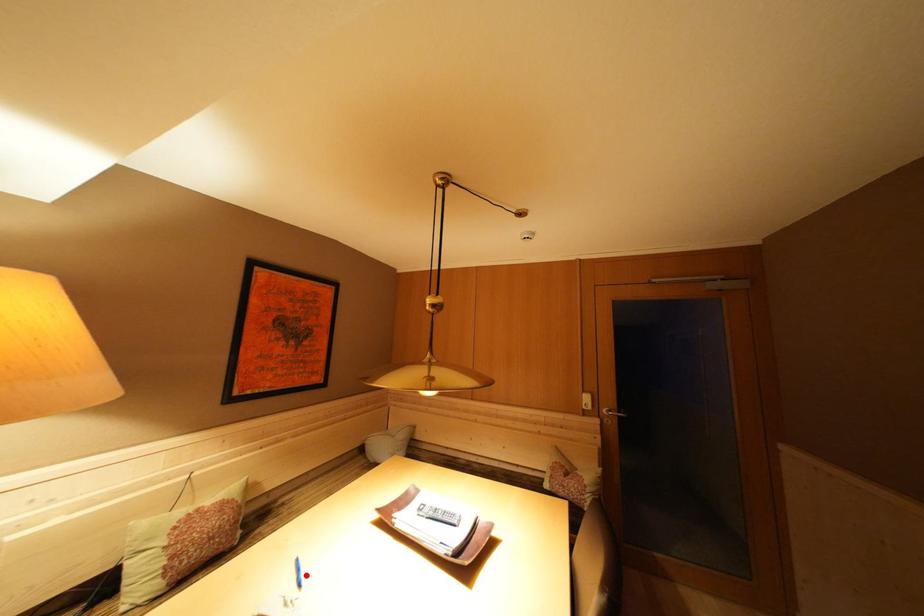
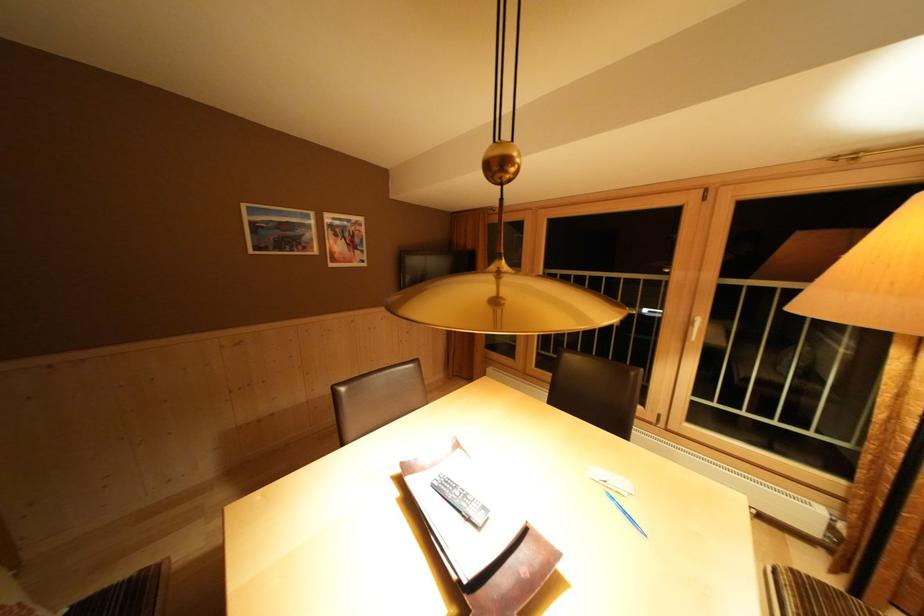
Locate, in the second image, the point that corresponds to the highlighted location in the first image.

(633, 517)